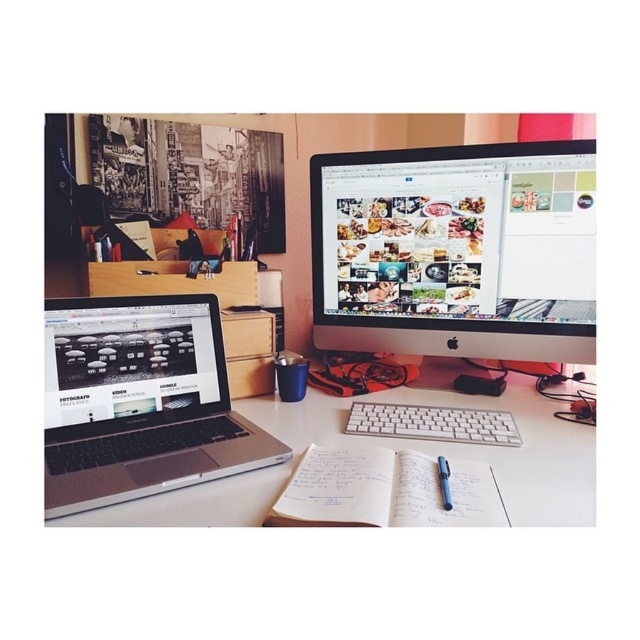
How far apart are white paper notebook at center and black plastic pen at center?

They are 3.12 inches apart.

Does white paper notebook at center appear on the left side of black plastic pen at center?

Correct, you'll find white paper notebook at center to the left of black plastic pen at center.

Who is more distant from viewer, (314, 480) or (451, 500)?

The point (314, 480) is behind.

You are a GUI agent. You are given a task and a screenshot of the screen. Output one action in this format:
    pyautogui.click(x=<x>, y=<y>)
    Task: Click on the white paper notebook at center
    This screenshot has width=640, height=640.
    Given the screenshot: What is the action you would take?
    pyautogui.click(x=384, y=492)

Can you confirm if sleek silver laptop at lower left is thinner than satin black laptop at lower left?

In fact, sleek silver laptop at lower left might be wider than satin black laptop at lower left.

Is sleek silver laptop at lower left positioned before satin black laptop at lower left?

Yes.

Describe the element at coordinates (140, 401) in the screenshot. The height and width of the screenshot is (640, 640). I see `sleek silver laptop at lower left` at that location.

I want to click on sleek silver laptop at lower left, so click(140, 401).

Can you confirm if satin black monitor at upper center is positioned to the right of black plastic pen at center?

Indeed, satin black monitor at upper center is positioned on the right side of black plastic pen at center.

Can you confirm if satin black monitor at upper center is bigger than black plastic pen at center?

Correct, satin black monitor at upper center is larger in size than black plastic pen at center.

Is point (460, 150) positioned in front of point (449, 492)?

No, it is behind (449, 492).

At what (x,y) coordinates should I click in order to perform the action: click on satin black monitor at upper center. Please return your answer as a coordinate pair (x, y). Image resolution: width=640 pixels, height=640 pixels. Looking at the image, I should click on (456, 250).